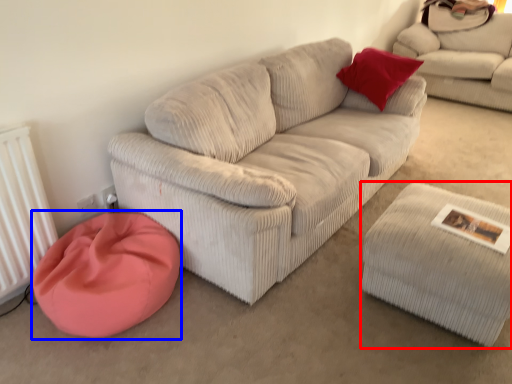
Question: Which point is further to the camera, stool (highlighted by a red box) or cat bed (highlighted by a blue box)?

Choices:
 (A) stool
 (B) cat bed

Answer: (B)